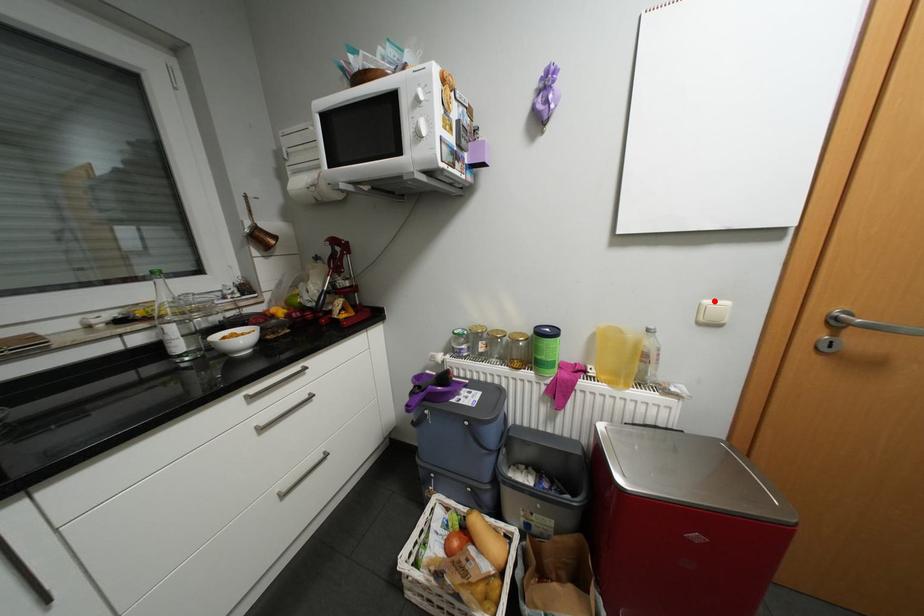
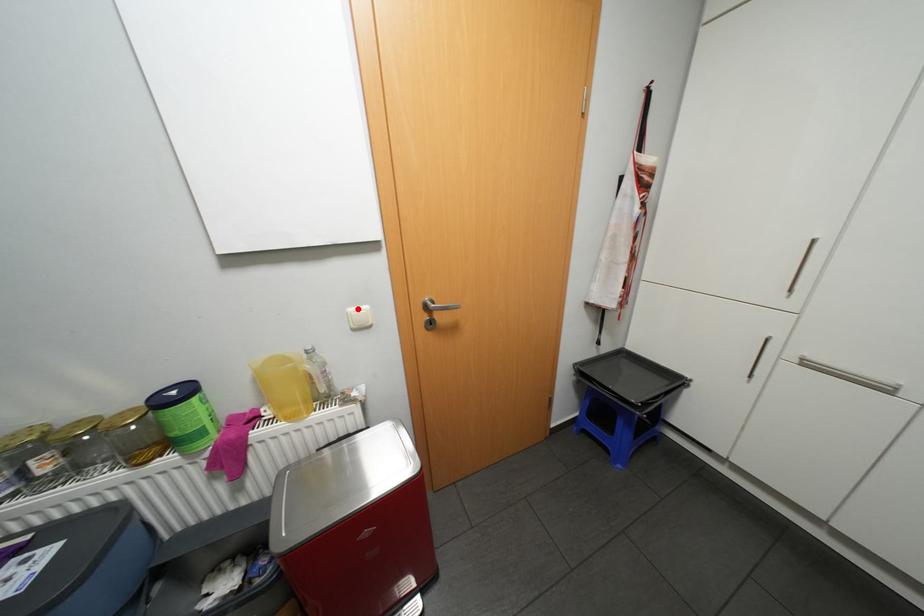
I am providing you with two images of the same scene from different viewpoints. A red point is marked on the first image and another point is marked on the second image. Are the points marked in image1 and image2 representing the same 3D position?

Yes